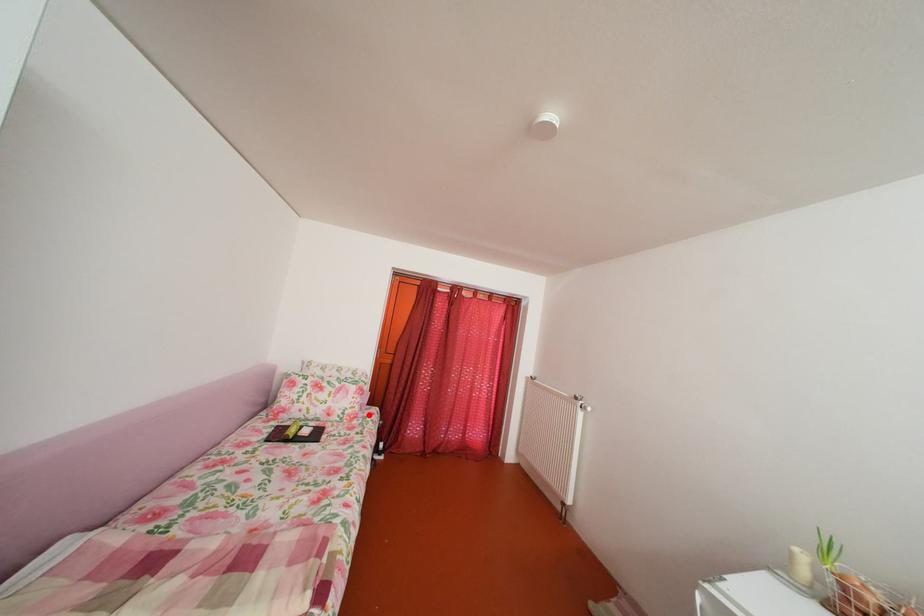
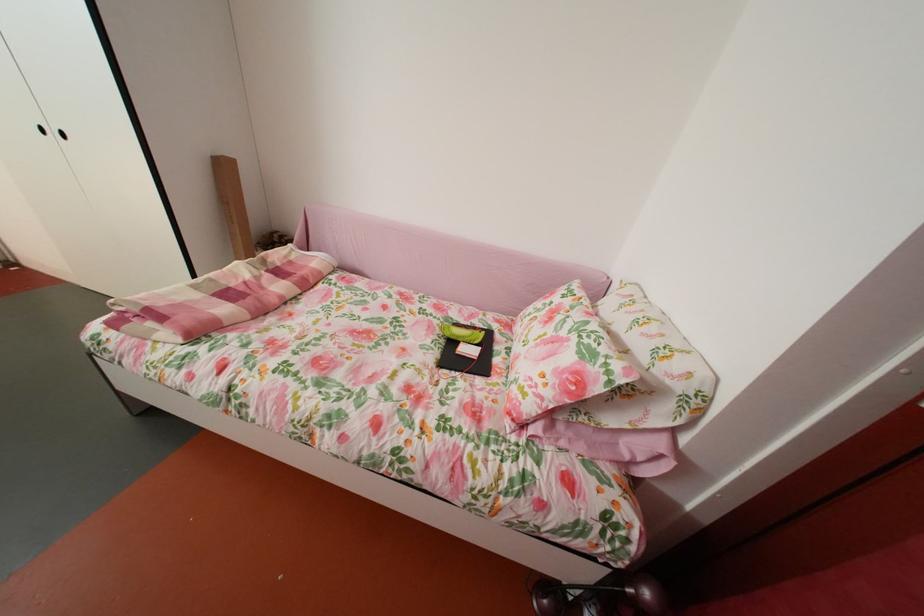
Where in the second image is the point corresponding to the highlighted location from the first image?

(541, 413)